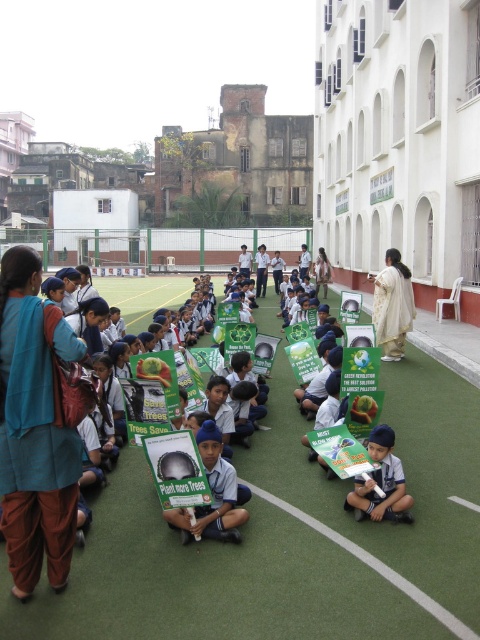
Can you confirm if white uniform child at center is shorter than white textured dress at center?

Incorrect, white uniform child at center's height does not fall short of white textured dress at center's.

Does white uniform child at center appear over white textured dress at center?

Incorrect, white uniform child at center is not positioned above white textured dress at center.

Who is more distant from viewer, [207,433] or [396,326]?

The point [396,326] is behind.

Image resolution: width=480 pixels, height=640 pixels. I want to click on white uniform child at center, so click(x=214, y=493).

Who is taller, white paper at center or white textured dress at center?

white paper at center

Can you confirm if white paper at center is wider than white textured dress at center?

Correct, the width of white paper at center exceeds that of white textured dress at center.

Is point (402, 472) positioned in front of point (377, 276)?

Yes, point (402, 472) is in front of point (377, 276).

The image size is (480, 640). In order to click on white paper at center in this screenshot , I will do `click(382, 481)`.

Can you confirm if blue cotton kurta at center is thinner than white uniform child at center?

Indeed, blue cotton kurta at center has a lesser width compared to white uniform child at center.

Is point (41, 472) in front of point (202, 506)?

That is True.

Identify the location of blue cotton kurta at center. (35, 428).